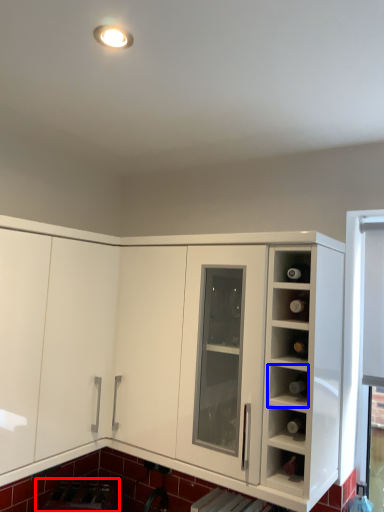
Question: Which point is further to the camera, appliance (highlighted by a red box) or shelf (highlighted by a blue box)?

Choices:
 (A) appliance
 (B) shelf

Answer: (A)